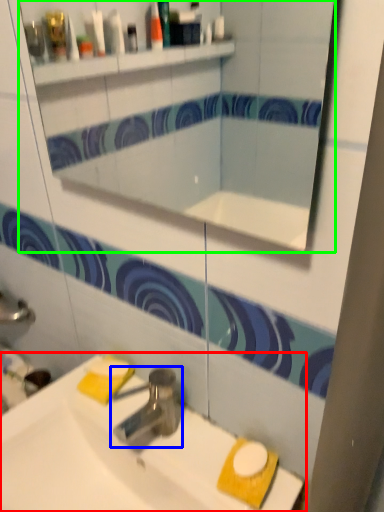
Question: Considering the real-world distances, which object is closest to sink (highlighted by a red box)? tap (highlighted by a blue box) or mirror (highlighted by a green box).

Choices:
 (A) tap
 (B) mirror

Answer: (A)